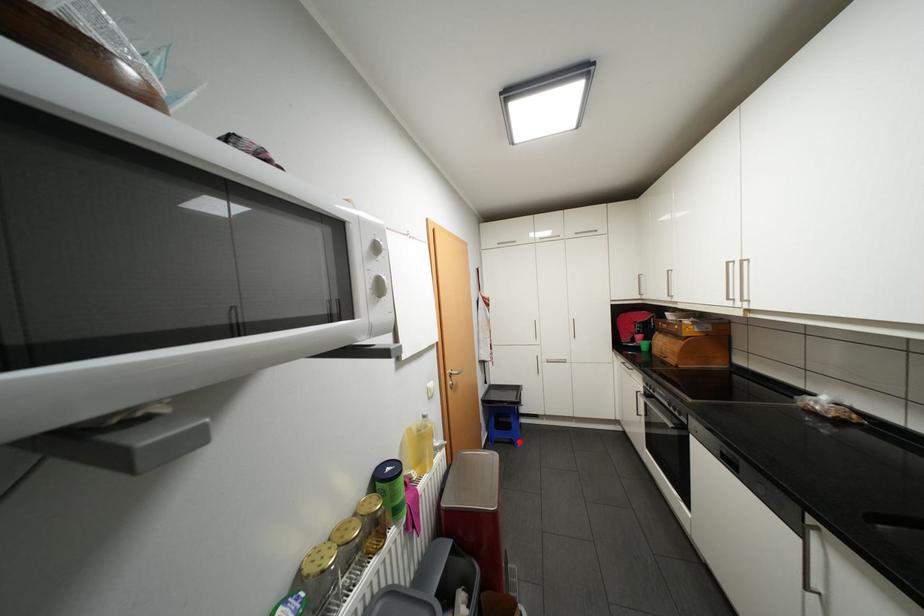
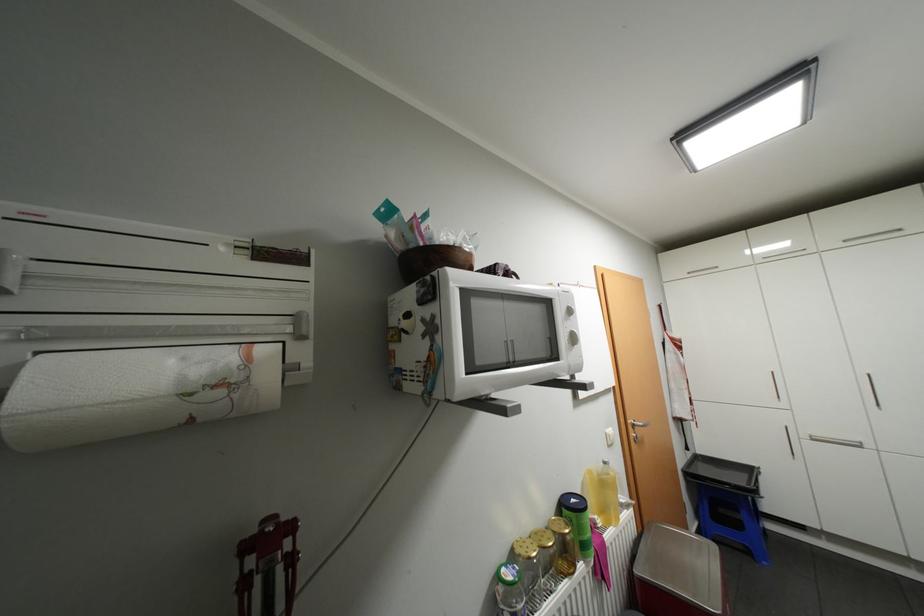
Question: I am providing you with two images of the same scene from different viewpoints. In image1, a red point is highlighted. Considering the same 3D point in image2, which of the following is correct?

Choices:
 (A) It is closer
 (B) It is farther

Answer: (A)